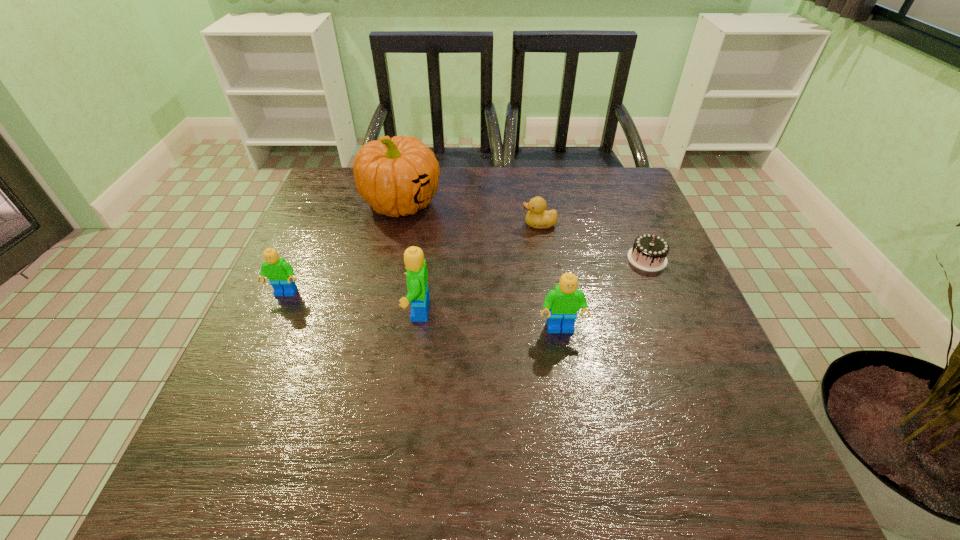
Locate an element on the screen. This screenshot has width=960, height=540. vacant space located on the face of the second Lego from left to right is located at coordinates (276, 311).

I want to click on free space located 0.160m on the face of the second Lego from left to right, so click(331, 311).

At what (x,y) coordinates should I click in order to perform the action: click on free space located 0.150m on the face of the second Lego from left to right. Please return your answer as a coordinate pair (x, y). The image size is (960, 540). Looking at the image, I should click on (336, 311).

Locate an element on the screen. The width and height of the screenshot is (960, 540). vacant region located 0.070m on the face of the rightmost Lego is located at coordinates (567, 367).

Identify the location of vacant space situated 0.230m on the surface of the pumpkin. The height and width of the screenshot is (540, 960). (381, 292).

You are a GUI agent. You are given a task and a screenshot of the screen. Output one action in this format:
    pyautogui.click(x=<x>, y=<y>)
    Task: Click on the free space located 0.230m facing forward on the duckling
    The width and height of the screenshot is (960, 540).
    Given the screenshot: What is the action you would take?
    pyautogui.click(x=435, y=225)

Locate an element on the screen. Image resolution: width=960 pixels, height=540 pixels. free point located facing forward on the duckling is located at coordinates (408, 225).

This screenshot has width=960, height=540. Find the location of `free point located 0.380m facing forward on the duckling`. free point located 0.380m facing forward on the duckling is located at coordinates (378, 225).

This screenshot has width=960, height=540. I want to click on vacant space situated on the back of the third farthest object, so pyautogui.click(x=627, y=209).

Find the location of a particular element. Image resolution: width=960 pixels, height=540 pixels. object positioned at the far edge is located at coordinates (396, 176).